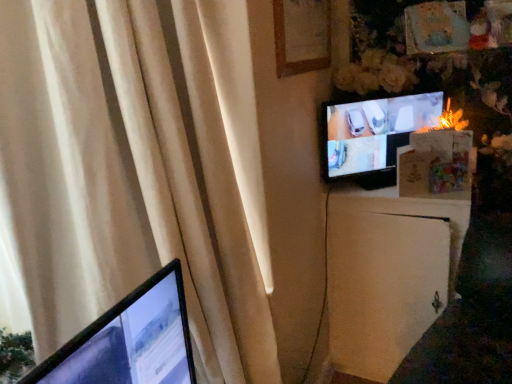
Question: From a real-world perspective, relative to matte black tv at upper right, is beige fabric curtain at left vertically above or below?

Choices:
 (A) below
 (B) above

Answer: (A)

Question: Looking at their shapes, would you say beige fabric curtain at left is wider or thinner than matte black tv at upper right?

Choices:
 (A) thin
 (B) wide

Answer: (B)

Question: Which object is the closest to the beige fabric curtain at left?

Choices:
 (A) matte black tv at upper right
 (B) white matte file cabinet at right
 (C) wooden picture frame at upper center

Answer: (C)

Question: Estimate the real-world distances between objects in this image. Which object is farther from the white matte file cabinet at right?

Choices:
 (A) wooden picture frame at upper center
 (B) matte black tv at upper right
 (C) beige fabric curtain at left

Answer: (A)